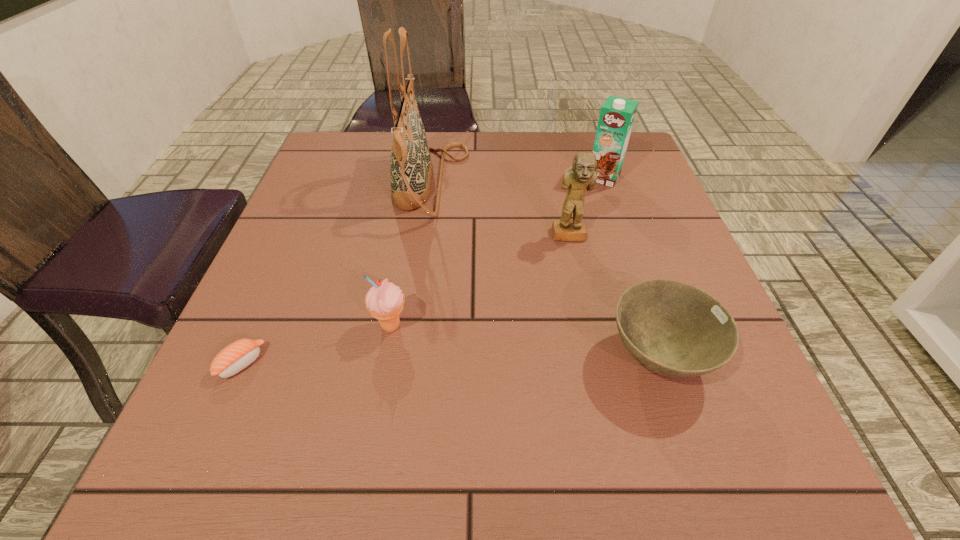
What are the coordinates of `handbag` in the screenshot? It's located at (411, 168).

The width and height of the screenshot is (960, 540). Identify the location of carton. (617, 115).

Where is `figurine`? figurine is located at coordinates (581, 175).

Where is `icecream`? The image size is (960, 540). icecream is located at coordinates (385, 301).

Locate an element on the screen. Image resolution: width=960 pixels, height=540 pixels. bowl is located at coordinates click(672, 328).

Where is `sushi`? This screenshot has width=960, height=540. sushi is located at coordinates (235, 357).

This screenshot has width=960, height=540. I want to click on the shortest object, so click(235, 357).

Identify the location of free space located 0.060m on the front-facing side of the tallest object. (492, 183).

What are the coordinates of `vacant area situated on the left of the carton` in the screenshot? It's located at (455, 177).

Locate an element on the screen. vacant space situated on the front-facing side of the figurine is located at coordinates (580, 290).